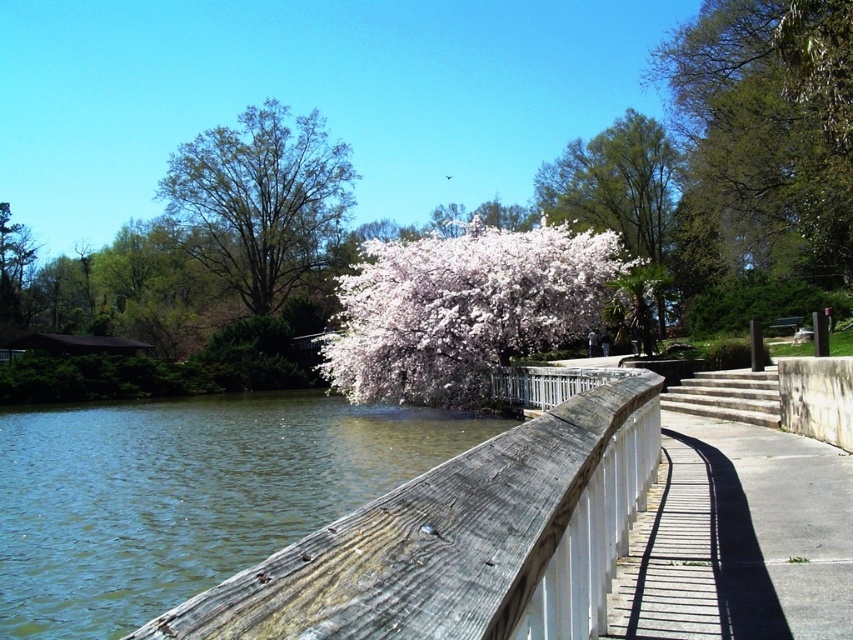
You are a photographer standing at the edge of the wooden walkway. You want to take a photo that includes both the weathered wood rail at center and the white concrete pavement at lower right. Which object should you position closer to the camera to ensure both are in focus?

The weathered wood rail at center is in front of the white concrete pavement at lower right, so to ensure both are in focus, position the weathered wood rail at center closer to the camera.